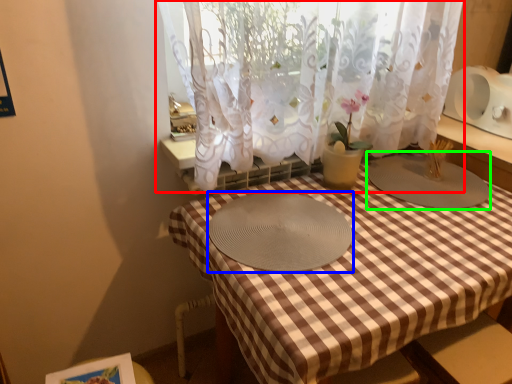
Question: Which is farther away from curtain (highlighted by a red box)? glass plate (highlighted by a blue box) or glass plate (highlighted by a green box)?

Choices:
 (A) glass plate
 (B) glass plate

Answer: (B)